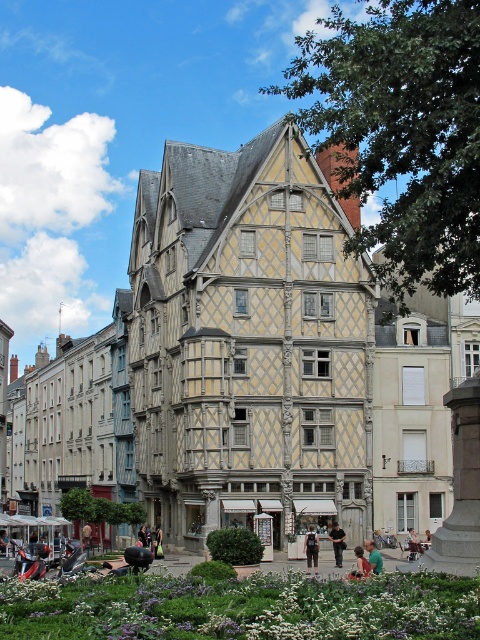
In the scene shown: You are standing at the point with coordinates point (375, 556) and want to walk to the point (38, 369). Based on the scene description, will the half timbered building block your path?

Point (38, 369) is behind point (375, 556), so the half timbered building will block your path to point (38, 369).

You are a delivery person who needs to carry a dark gray fabric backpack at center and a green fabric shirt at lower center. If you have a small bag that can only hold items that take up less space, which item should you put in the bag first?

The dark gray fabric backpack at center occupies less space than the green fabric shirt at lower center, so you should put the dark gray fabric backpack at center in the bag first.

You are standing on the street looking at the half timbered building. You see a person wearing dark blue jeans at lower center and a green fabric shirt at lower center. Which piece of clothing is closer to you?

The dark blue jeans at lower center is further to the viewer than green fabric shirt at lower center. Therefore, the green fabric shirt at lower center is closer to you.